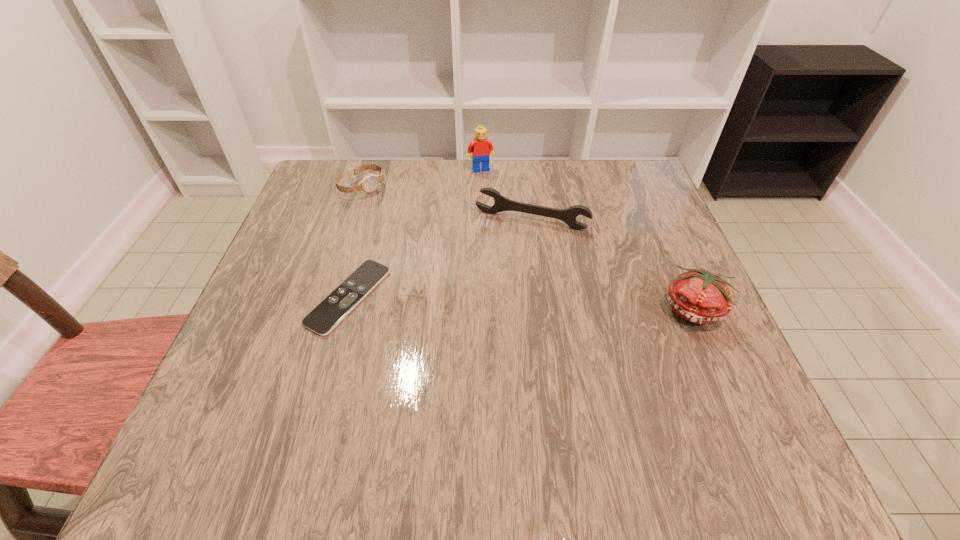
I want to click on vacant space on the desktop that is between the shortest object and the tomato and is positioned on the open ends of the third nearest object, so click(501, 303).

At what (x,y) coordinates should I click in order to perform the action: click on vacant space on the desktop that is between the remote control and the tomato and is positioned on the face of the second farthest object. Please return your answer as a coordinate pair (x, y). This screenshot has height=540, width=960. Looking at the image, I should click on (492, 302).

Where is `vacant space on the desktop that is between the shortest object and the tomato and is positioned on the face of the farthest object`? Image resolution: width=960 pixels, height=540 pixels. vacant space on the desktop that is between the shortest object and the tomato and is positioned on the face of the farthest object is located at coordinates (524, 303).